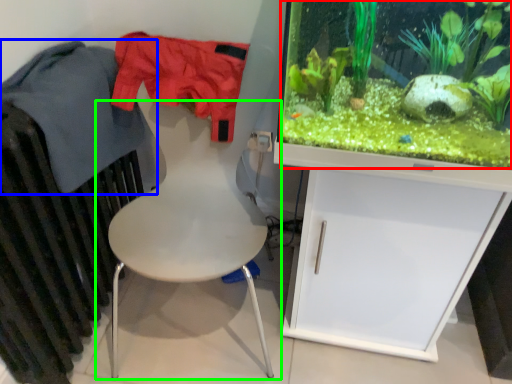
Question: Considering the real-world distances, which object is farthest from plant (highlighted by a red box)? clothing (highlighted by a blue box) or chair (highlighted by a green box)?

Choices:
 (A) clothing
 (B) chair

Answer: (A)